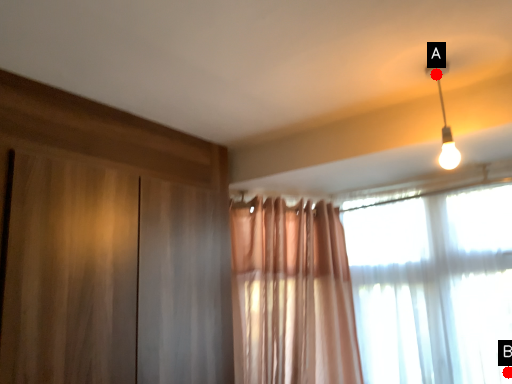
Question: Two points are circled on the image, labeled by A and B beside each circle. Among these points, which one is farthest from the camera?

Choices:
 (A) A is further
 (B) B is further

Answer: (B)